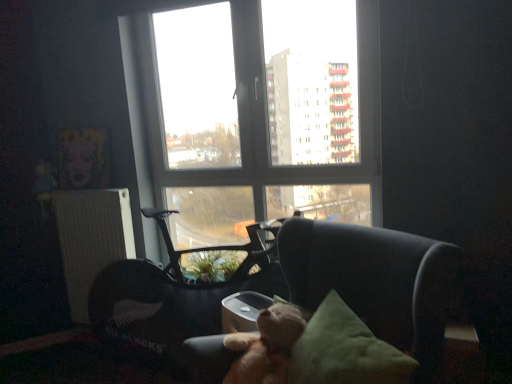
Question: Considering the relative sizes of white textured radiator at left and green fabric pillow at center in the image provided, is white textured radiator at left thinner than green fabric pillow at center?

Choices:
 (A) no
 (B) yes

Answer: (B)

Question: Does white textured radiator at left contain green fabric pillow at center?

Choices:
 (A) no
 (B) yes

Answer: (A)

Question: From a real-world perspective, is white textured radiator at left on top of green fabric pillow at center?

Choices:
 (A) no
 (B) yes

Answer: (B)

Question: Is white textured radiator at left next to green fabric pillow at center and touching it?

Choices:
 (A) no
 (B) yes

Answer: (A)

Question: Considering the relative positions of white textured radiator at left and green fabric pillow at center in the image provided, is white textured radiator at left behind green fabric pillow at center?

Choices:
 (A) yes
 (B) no

Answer: (A)

Question: Is point (344, 175) positioned closer to the camera than point (176, 274)?

Choices:
 (A) closer
 (B) farther

Answer: (A)

Question: Is transparent glass window at center inside or outside of black plastic swivel chair at center?

Choices:
 (A) inside
 (B) outside

Answer: (B)

Question: Looking at the image, does transparent glass window at center seem bigger or smaller compared to black plastic swivel chair at center?

Choices:
 (A) big
 (B) small

Answer: (A)

Question: Looking at their shapes, would you say transparent glass window at center is wider or thinner than black plastic swivel chair at center?

Choices:
 (A) wide
 (B) thin

Answer: (B)

Question: In terms of height, does light brown plush at center look taller or shorter compared to transparent glass window at center?

Choices:
 (A) tall
 (B) short

Answer: (B)

Question: Is light brown plush at center wider or thinner than transparent glass window at center?

Choices:
 (A) wide
 (B) thin

Answer: (A)

Question: Is point (269, 370) positioned closer to the camera than point (232, 107)?

Choices:
 (A) closer
 (B) farther

Answer: (A)

Question: Relative to transparent glass window at center, is light brown plush at center in front or behind?

Choices:
 (A) front
 (B) behind

Answer: (A)

Question: Is point (90, 226) closer or farther from the camera than point (123, 278)?

Choices:
 (A) farther
 (B) closer

Answer: (A)

Question: Considering the positions of white textured radiator at left and black plastic swivel chair at center in the image, is white textured radiator at left taller or shorter than black plastic swivel chair at center?

Choices:
 (A) short
 (B) tall

Answer: (A)